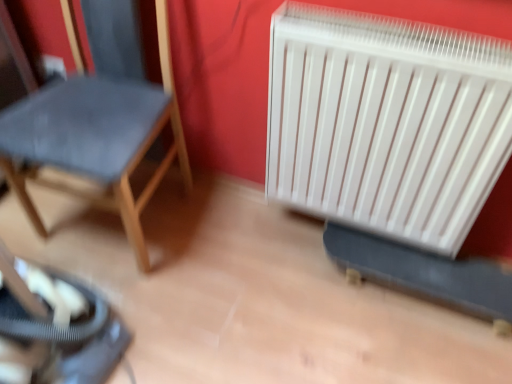
Where is `free space above white plastic radiator at right (from a real-world perspective)`? free space above white plastic radiator at right (from a real-world perspective) is located at coordinates (406, 33).